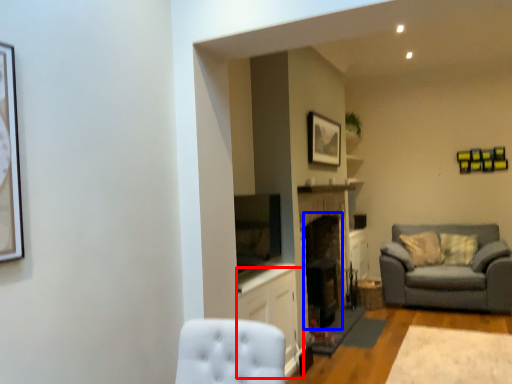
Question: Which of the following is the farthest to the observer, cabinetry (highlighted by a red box) or fireplace (highlighted by a blue box)?

Choices:
 (A) cabinetry
 (B) fireplace

Answer: (B)